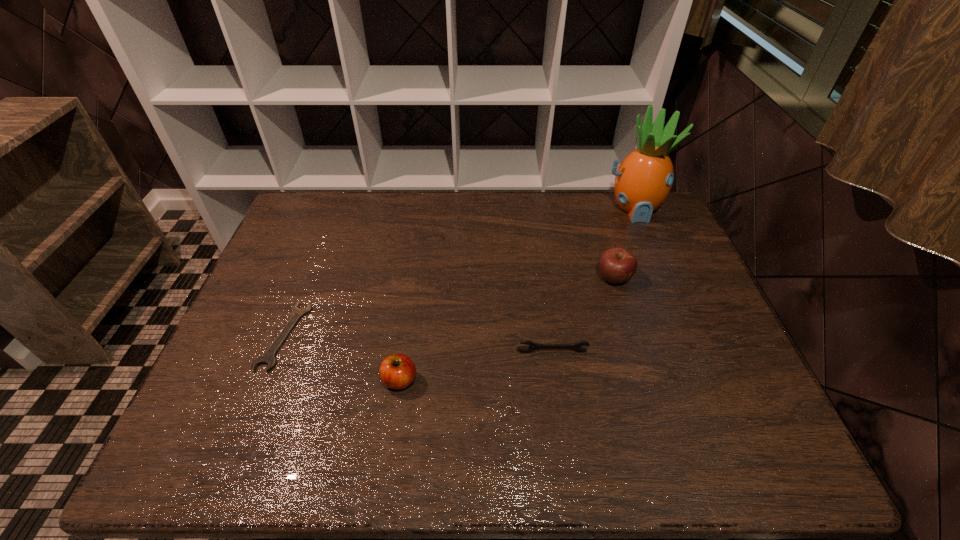
You are a GUI agent. You are given a task and a screenshot of the screen. Output one action in this format:
    pyautogui.click(x=<x>, y=<y>)
    Task: Click on the vacant region located at the entrance of the farthest object
    
    Given the screenshot: What is the action you would take?
    pyautogui.click(x=665, y=286)

This screenshot has width=960, height=540. I want to click on vacant space positioned on the side of the right apple with the unique marking, so click(x=647, y=386).

Identify the location of vacant space situated 0.110m on the front of the fourth object from right to left. (391, 441).

Locate an element on the screen. Image resolution: width=960 pixels, height=540 pixels. free space located 0.270m on the open ends of the right wrench is located at coordinates (567, 460).

Locate an element on the screen. free point located 0.070m on the left of the shorter wrench is located at coordinates (237, 336).

Locate an element on the screen. object that is at the far edge is located at coordinates (644, 179).

Locate an element on the screen. The width and height of the screenshot is (960, 540). object at the left edge is located at coordinates (268, 357).

This screenshot has height=540, width=960. In order to click on object situated at the right edge in this screenshot , I will do `click(644, 179)`.

This screenshot has height=540, width=960. Find the location of `object located at the far right corner`. object located at the far right corner is located at coordinates (644, 179).

This screenshot has height=540, width=960. In the image, there is a desktop. What are the coordinates of `free space at the far edge` in the screenshot? It's located at (392, 223).